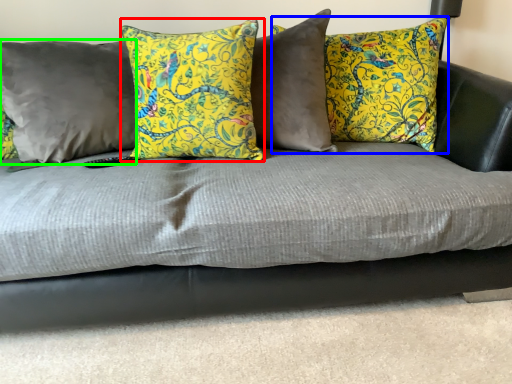
Question: Which object is the farthest from pillow (highlighted by a red box)? Choose among these: pillow (highlighted by a blue box) or pillow (highlighted by a green box).

Choices:
 (A) pillow
 (B) pillow

Answer: (A)